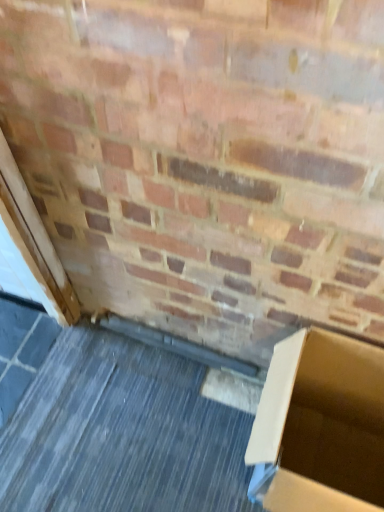
Where is `brown cardboard box at lower right`? The width and height of the screenshot is (384, 512). brown cardboard box at lower right is located at coordinates (320, 426).

The image size is (384, 512). What do you see at coordinates (320, 426) in the screenshot? I see `brown cardboard box at lower right` at bounding box center [320, 426].

The height and width of the screenshot is (512, 384). What are the coordinates of `brown cardboard box at lower right` in the screenshot? It's located at (320, 426).